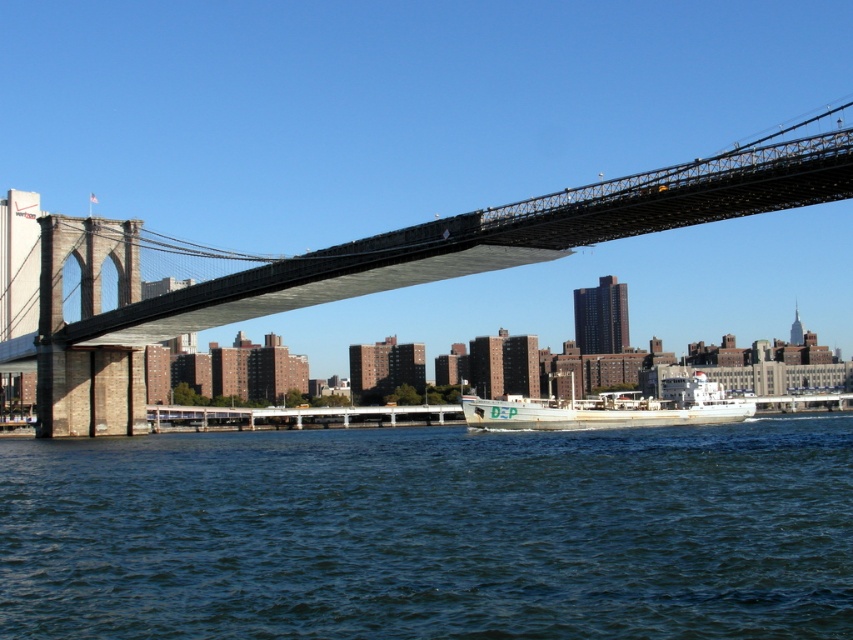
Question: Among these points, which one is farthest from the camera?

Choices:
 (A) (242, 444)
 (B) (74, 355)

Answer: (B)

Question: From the image, what is the correct spatial relationship of concrete bridge at center in relation to white matte boat at center?

Choices:
 (A) below
 (B) above

Answer: (B)

Question: Is concrete bridge at center to the right of white matte boat at center from the viewer's perspective?

Choices:
 (A) no
 (B) yes

Answer: (B)

Question: Can you confirm if dark blue water at center is smaller than concrete bridge at center?

Choices:
 (A) no
 (B) yes

Answer: (B)

Question: Based on their relative distances, which object is nearer to the concrete bridge at center?

Choices:
 (A) white matte boat at center
 (B) dark blue water at center

Answer: (B)

Question: Which point appears closest to the camera in this image?

Choices:
 (A) (730, 401)
 (B) (755, 438)
 (C) (735, 188)

Answer: (C)